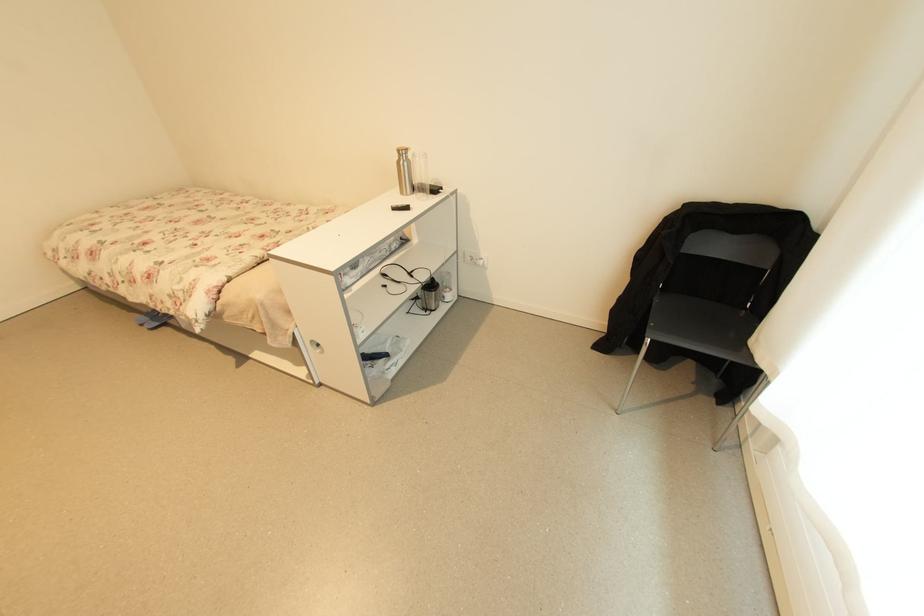
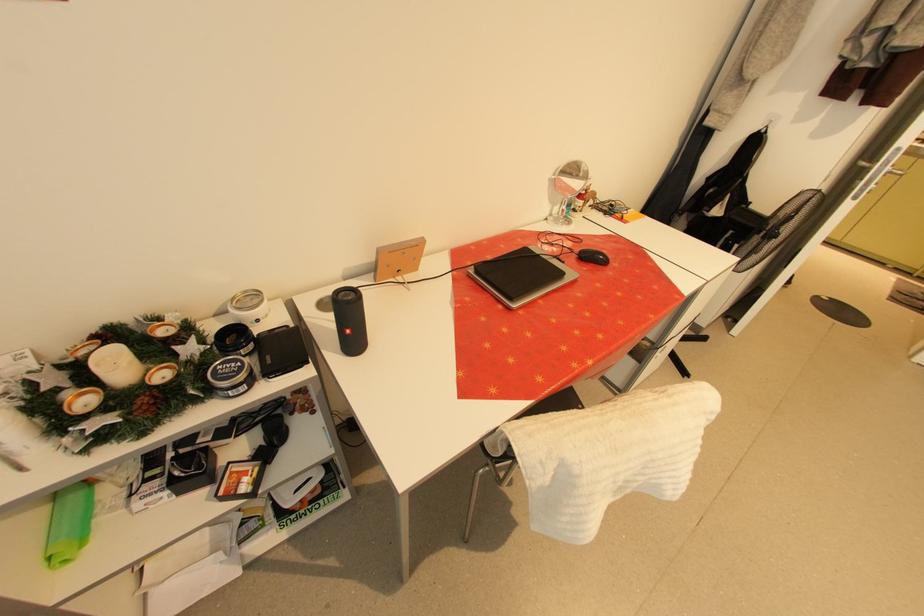
The images are taken continuously from a first-person perspective. In which direction is your viewpoint rotating?

The rotation direction of the camera is left-down.